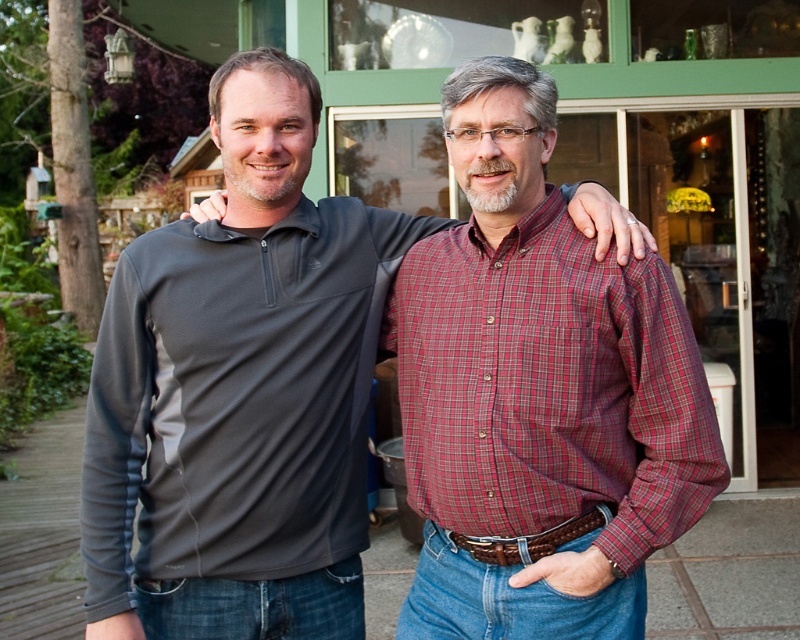
Question: Estimate the real-world distances between objects in this image. Which object is closer to the gray fleece pullover at center?

Choices:
 (A) plaid cotton shirt at center
 (B) brown leather belt at center

Answer: (A)

Question: Does plaid cotton shirt at center appear on the right side of brown leather belt at center?

Choices:
 (A) no
 (B) yes

Answer: (B)

Question: Considering the relative positions of plaid cotton shirt at center and brown leather belt at center in the image provided, where is plaid cotton shirt at center located with respect to brown leather belt at center?

Choices:
 (A) right
 (B) left

Answer: (A)

Question: Is gray fleece pullover at center below brown leather belt at center?

Choices:
 (A) yes
 (B) no

Answer: (B)

Question: Which point is farther from the camera taking this photo?

Choices:
 (A) (532, 545)
 (B) (342, 486)

Answer: (B)

Question: Which point is closer to the camera?

Choices:
 (A) (150, 413)
 (B) (558, 532)

Answer: (B)